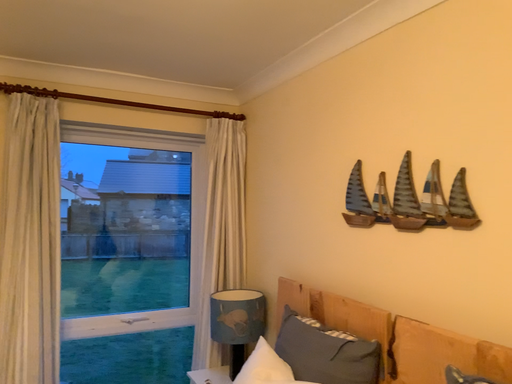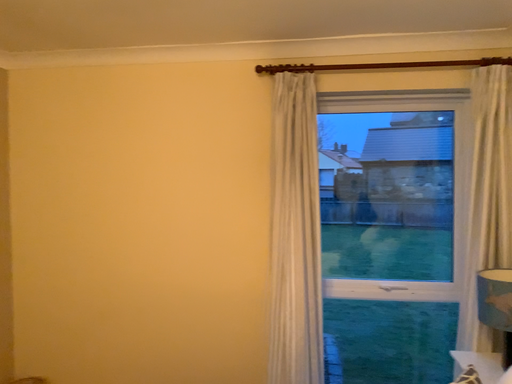
Question: How did the camera likely rotate when shooting the video?

Choices:
 (A) rotated right
 (B) rotated left

Answer: (B)